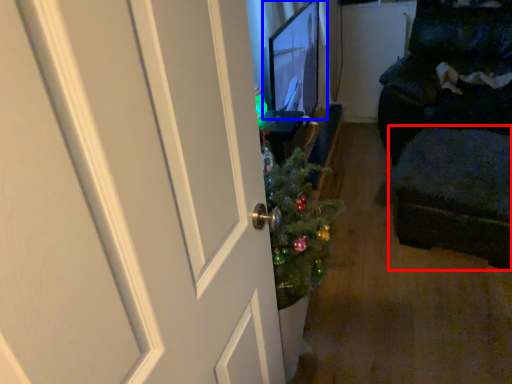
Question: Which object is further to the camera taking this photo, footrest (highlighted by a red box) or computer monitor (highlighted by a blue box)?

Choices:
 (A) footrest
 (B) computer monitor

Answer: (A)